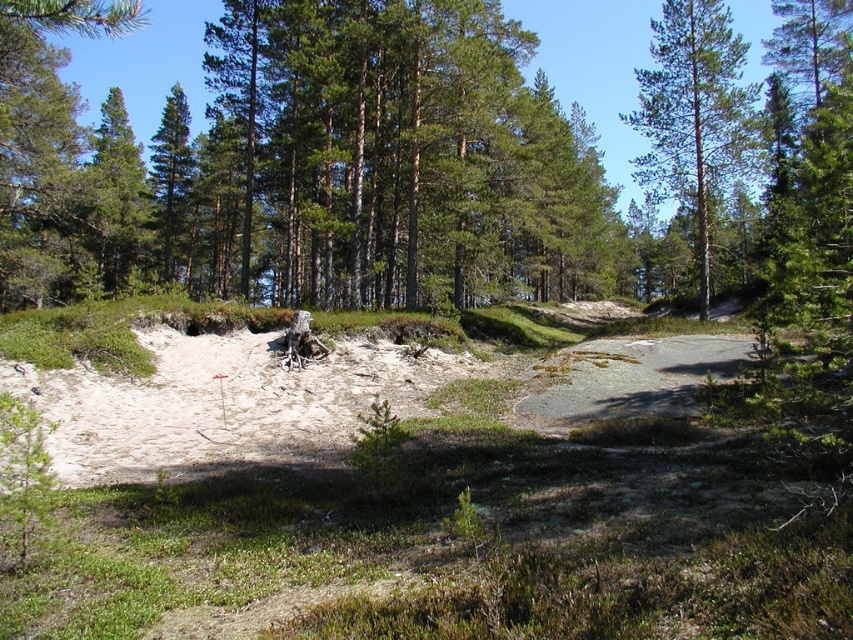
You are a hiker trying to navigate through the forest. You need to identify which tree is taller between the green textured pine tree at upper center and the green matte tree at center. Which one should you choose if you want to climb the taller one?

The green textured pine tree at upper center is larger in size than the green matte tree at center, so you should choose the green textured pine tree at upper center to climb since it is taller.